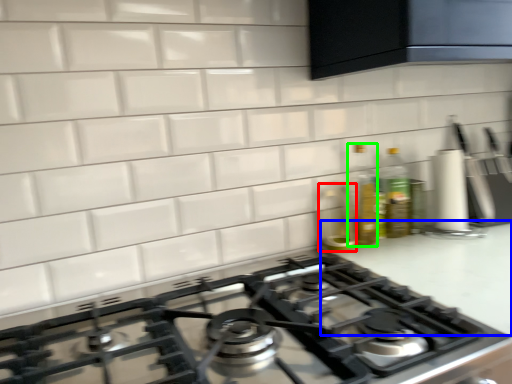
Question: Based on their relative distances, which object is nearer to appliance (highlighted by a red box)? Choose from counter top (highlighted by a blue box) and bottle (highlighted by a green box).

Choices:
 (A) counter top
 (B) bottle

Answer: (B)